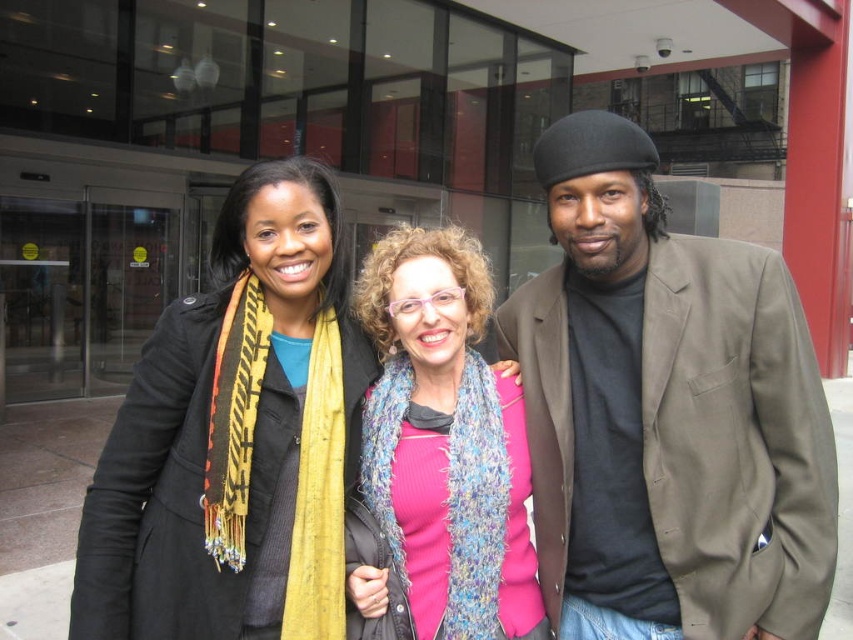
You are a fashion designer observing the scene. You need to decide which clothing item to feature in your next collection. Based on the spatial relationship between the matte brown blazer at center and the matte black coat at center, which one has a larger width?

The matte brown blazer at center might be wider than the matte black coat at center, so the matte brown blazer at center is likely the better choice for featuring in the collection due to its wider design.

You are a fashion designer observing the scene. You need to decide which item is better suited for a winter collection based on their visibility in the outfit. Which item, the matte black coat at center or the pink knitted scarf at center, is more prominent in height?

The matte black coat at center is taller than the pink knitted scarf at center, so the matte black coat at center is more prominent in height and would be more visible in the outfit.